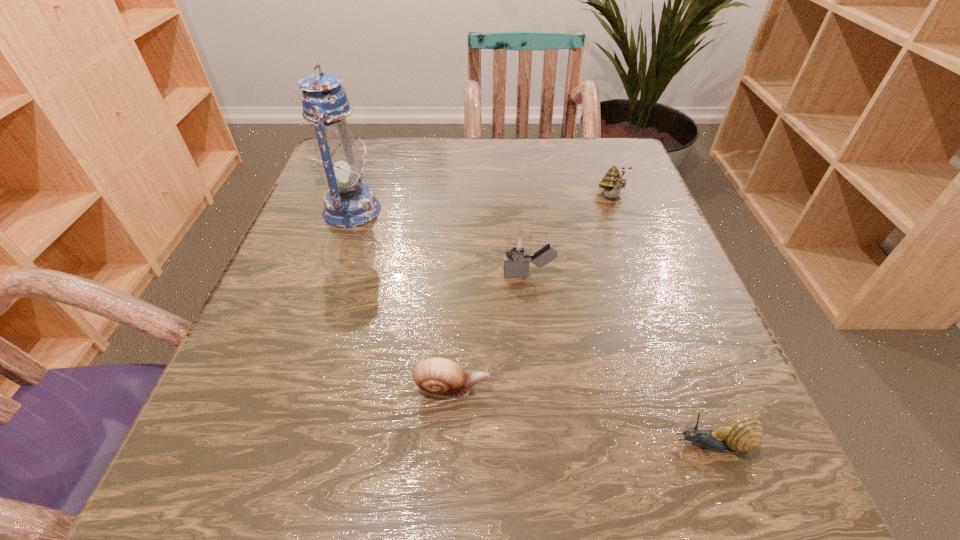
This screenshot has height=540, width=960. In order to click on object that is at the far right corner in this screenshot , I will do `click(612, 182)`.

At what (x,y) coordinates should I click in order to perform the action: click on object at the near right corner. Please return your answer as a coordinate pair (x, y). Looking at the image, I should click on pos(742,433).

In the image, there is a desktop. Where is `vacant space at the far edge`? The height and width of the screenshot is (540, 960). vacant space at the far edge is located at coordinates (396, 180).

Identify the location of vacant space at the near edge of the desktop. Image resolution: width=960 pixels, height=540 pixels. (636, 471).

Where is `free region at the right edge of the desktop`? free region at the right edge of the desktop is located at coordinates (703, 324).

Find the location of a particular element. The height and width of the screenshot is (540, 960). vacant space at the far left corner of the desktop is located at coordinates (326, 184).

The height and width of the screenshot is (540, 960). Find the location of `free space at the far right corner`. free space at the far right corner is located at coordinates (607, 139).

Find the location of a particular element. The image size is (960, 540). free space at the near right corner of the desktop is located at coordinates (732, 468).

Image resolution: width=960 pixels, height=540 pixels. I want to click on empty location between the farthest escargot and the tallest object, so click(x=482, y=204).

Identify the location of vacant space that's between the third object from right to left and the nearest escargot. (621, 360).